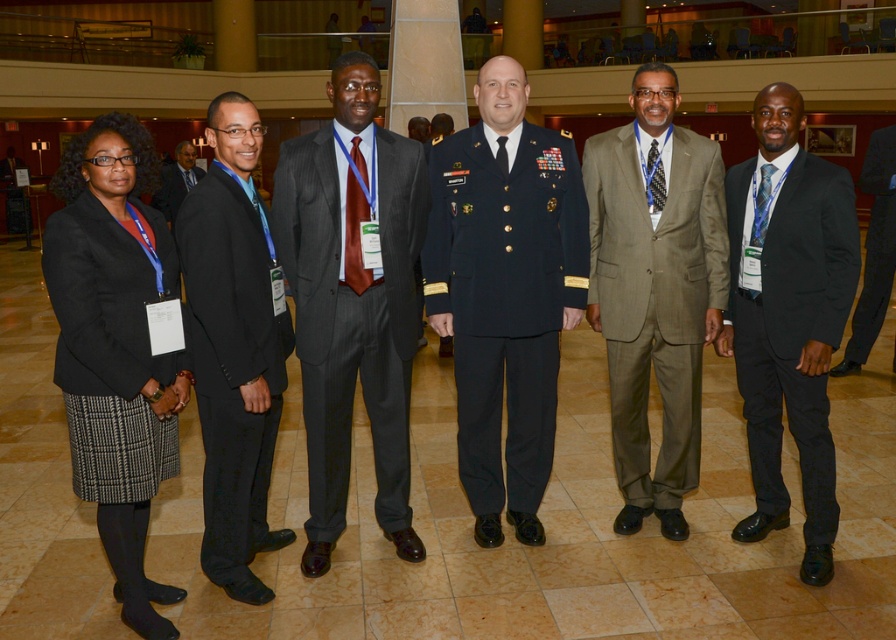
Does dark gray pinstripe suit at center appear on the right side of matte black blazer at left?

Correct, you'll find dark gray pinstripe suit at center to the right of matte black blazer at left.

Between dark gray pinstripe suit at center and matte black blazer at left, which one has less height?

With less height is matte black blazer at left.

Find the location of a particular element. The height and width of the screenshot is (640, 896). dark gray pinstripe suit at center is located at coordinates (352, 301).

Can you confirm if khaki wool suit at center is positioned to the right of black suit at left?

Correct, you'll find khaki wool suit at center to the right of black suit at left.

Does khaki wool suit at center have a greater width compared to black suit at left?

Yes, khaki wool suit at center is wider than black suit at left.

Where is `khaki wool suit at center`? khaki wool suit at center is located at coordinates coord(655,289).

Describe the element at coordinates (352, 301) in the screenshot. I see `dark gray pinstripe suit at center` at that location.

Between dark gray pinstripe suit at center and black suit at left, which one appears on the left side from the viewer's perspective?

→ Positioned to the left is black suit at left.

Does point (330, 516) come behind point (237, 108)?

Yes, point (330, 516) is behind point (237, 108).

Find the location of `dark gray pinstripe suit at center`. dark gray pinstripe suit at center is located at coordinates (352, 301).